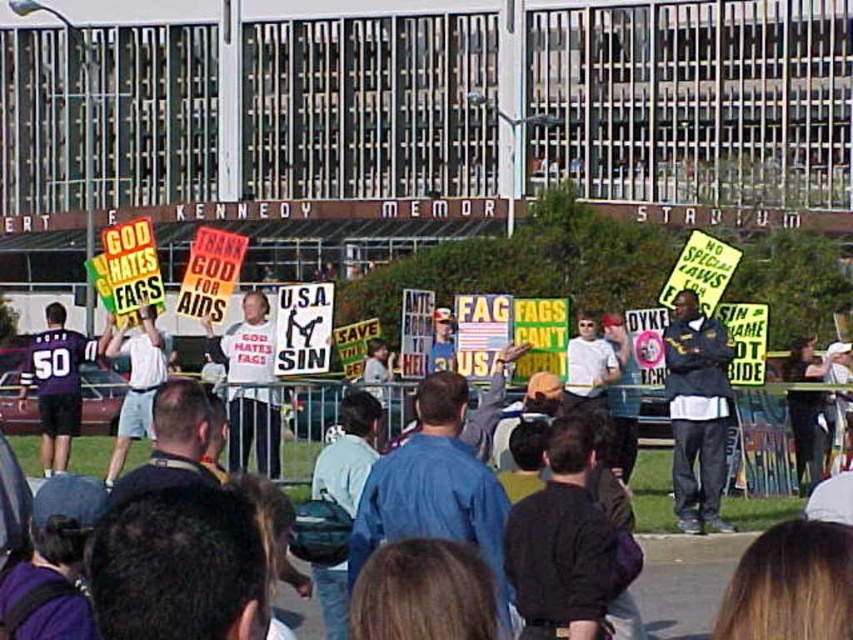
Question: Estimate the real-world distances between objects in this image. Which object is farther from the white cotton shirt at center?

Choices:
 (A) dark blue jacket at center
 (B) matte purple jersey at left

Answer: (A)

Question: Is matte purple jersey at left in front of white cotton shirt at center?

Choices:
 (A) yes
 (B) no

Answer: (B)

Question: Is dark blue jacket at center to the left of matte purple jersey at left from the viewer's perspective?

Choices:
 (A) yes
 (B) no

Answer: (B)

Question: Which point is closer to the camera?

Choices:
 (A) (74, 410)
 (B) (689, 301)
 (C) (151, 403)

Answer: (B)

Question: Can you confirm if dark blue jacket at center is positioned above matte purple jersey at left?

Choices:
 (A) yes
 (B) no

Answer: (A)

Question: Which object is the farthest from the dark blue jacket at center?

Choices:
 (A) white cotton shirt at center
 (B) matte purple jersey at left

Answer: (B)